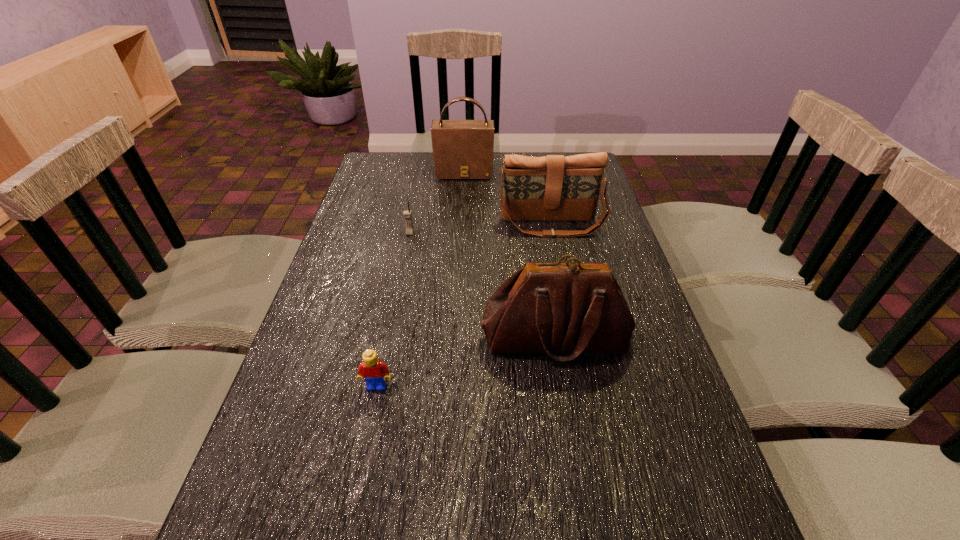
Identify the location of object at the far edge. (462, 149).

Locate an element on the screen. The height and width of the screenshot is (540, 960). object positioned at the left edge is located at coordinates (374, 371).

Identify the location of vacant space at the far edge of the desktop. The width and height of the screenshot is (960, 540). (419, 164).

In the image, there is a desktop. In order to click on vacant space at the left edge in this screenshot , I will do `click(356, 368)`.

You are a GUI agent. You are given a task and a screenshot of the screen. Output one action in this format:
    pyautogui.click(x=<x>, y=<y>)
    Task: Click on the free space at the right edge of the desktop
    
    Given the screenshot: What is the action you would take?
    pyautogui.click(x=699, y=433)

This screenshot has height=540, width=960. What are the coordinates of `vacant space at the far right corner` in the screenshot? It's located at (546, 153).

I want to click on free spot between the nearest shoulder bag and the nearest object, so click(467, 362).

Identify the location of free space between the fourth farthest object and the cellular telephone. The image size is (960, 540). (483, 286).

This screenshot has height=540, width=960. I want to click on vacant space that's between the second nearest shoulder bag and the cellular telephone, so click(481, 229).

Where is `free space between the second farthest shoulder bag and the cellular telephone`? The image size is (960, 540). free space between the second farthest shoulder bag and the cellular telephone is located at coordinates (481, 229).